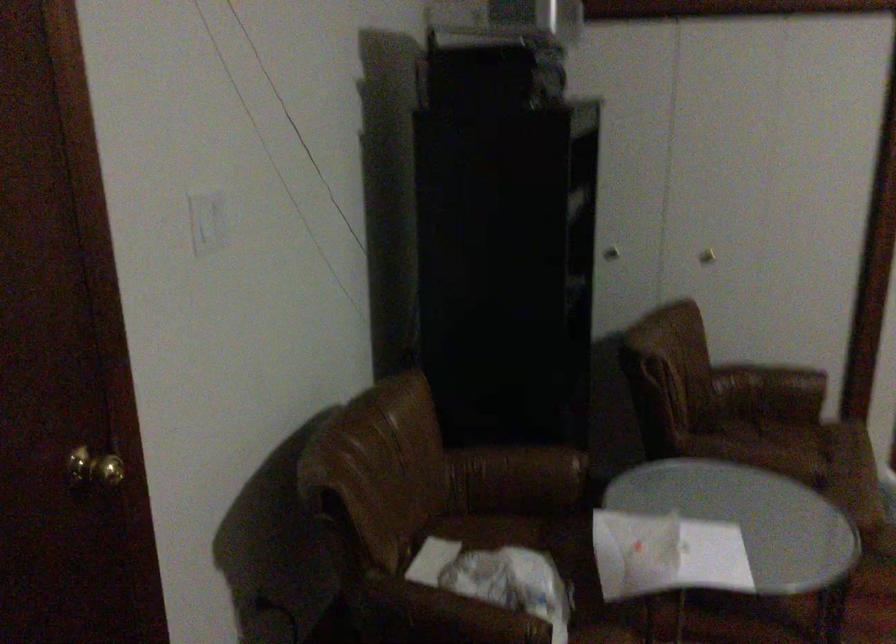
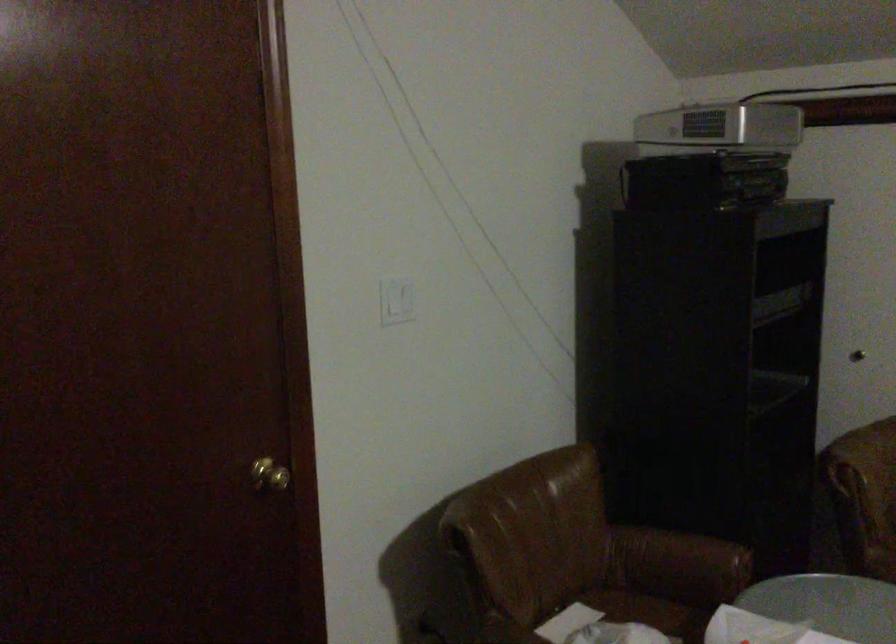
Question: What movement of the cameraman would produce the second image?

Choices:
 (A) Left
 (B) Right
 (C) Forward
 (D) Backward

Answer: (B)